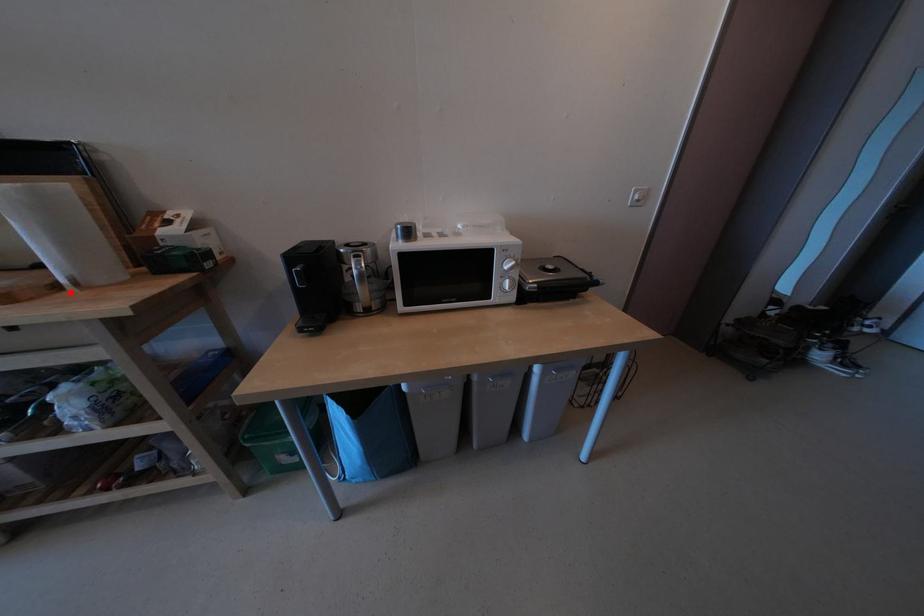
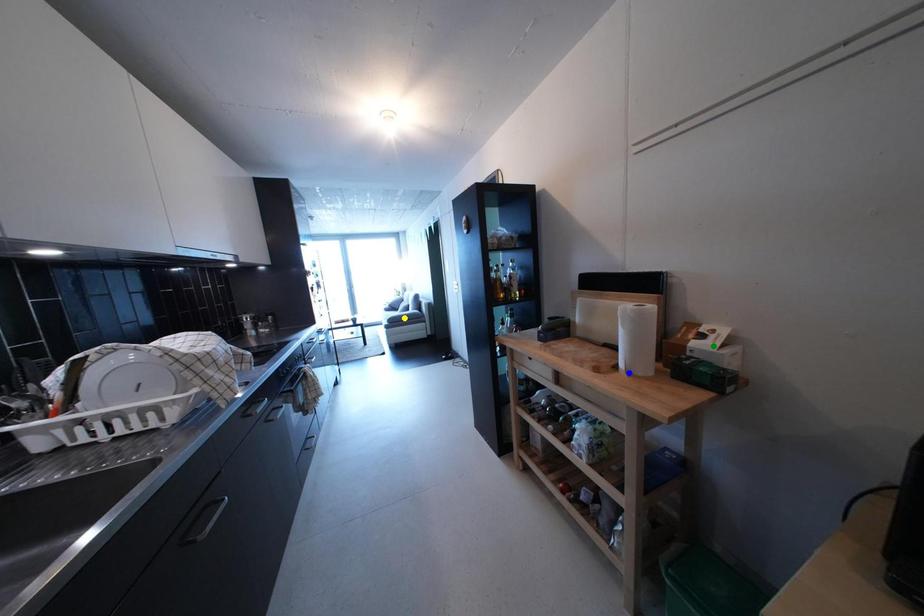
Question: I am providing you with two images of the same scene from different viewpoints. A red point is marked on the first image. You are given multiple points on the second image. Which spot in image 2 lines up with the point in image 1?

Choices:
 (A) green point
 (B) yellow point
 (C) blue point

Answer: (C)